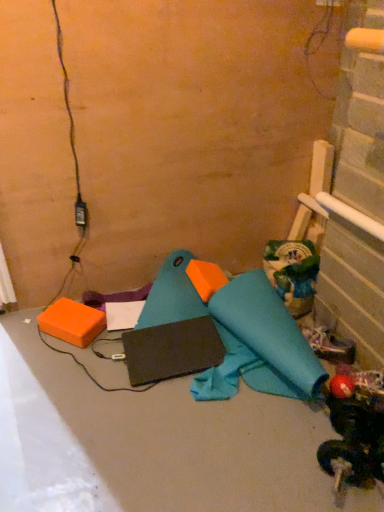
Question: From a real-world perspective, is orange foam block at lower left on rubberized red ball at lower right, acting as the first toy starting from the front?

Choices:
 (A) yes
 (B) no

Answer: (B)

Question: Is orange foam block at lower left not near rubberized red ball at lower right, acting as the first toy starting from the front?

Choices:
 (A) no
 (B) yes

Answer: (A)

Question: Does orange foam block at lower left have a greater width compared to rubberized red ball at lower right, which appears as the first toy when ordered from the bottom?

Choices:
 (A) no
 (B) yes

Answer: (A)

Question: From the image's perspective, is orange foam block at lower left located above rubberized red ball at lower right, acting as the first toy starting from the front?

Choices:
 (A) no
 (B) yes

Answer: (B)

Question: Does orange foam block at lower left have a lesser height compared to rubberized red ball at lower right, which appears as the first toy when ordered from the bottom?

Choices:
 (A) no
 (B) yes

Answer: (B)

Question: From a real-world perspective, is black matte laptop at center positioned above or below matte black laptop at center?

Choices:
 (A) below
 (B) above

Answer: (B)

Question: From the image's perspective, is black matte laptop at center above or below matte black laptop at center?

Choices:
 (A) below
 (B) above

Answer: (B)

Question: Is black matte laptop at center wider or thinner than matte black laptop at center?

Choices:
 (A) thin
 (B) wide

Answer: (A)

Question: Considering the positions of point (180, 374) and point (309, 510), is point (180, 374) closer or farther from the camera than point (309, 510)?

Choices:
 (A) farther
 (B) closer

Answer: (A)

Question: Does point (231, 482) appear closer or farther from the camera than point (354, 374)?

Choices:
 (A) farther
 (B) closer

Answer: (B)

Question: Visually, is matte black laptop at center positioned to the left or to the right of rubberized red ball at lower right, which is the 2th toy in top-to-bottom order?

Choices:
 (A) left
 (B) right

Answer: (A)

Question: Considering the positions of matte black laptop at center and rubberized red ball at lower right, which is the 2th toy in top-to-bottom order, in the image, is matte black laptop at center wider or thinner than rubberized red ball at lower right, which is the 2th toy in top-to-bottom order,?

Choices:
 (A) thin
 (B) wide

Answer: (B)

Question: Is matte black laptop at center in front of or behind rubberized red ball at lower right, which is the 2th toy in top-to-bottom order, in the image?

Choices:
 (A) front
 (B) behind

Answer: (A)

Question: In the image, is matte black laptop at center positioned in front of or behind white fabric shoe at lower right?

Choices:
 (A) front
 (B) behind

Answer: (A)

Question: Does point (77, 494) appear closer or farther from the camera than point (350, 347)?

Choices:
 (A) farther
 (B) closer

Answer: (B)